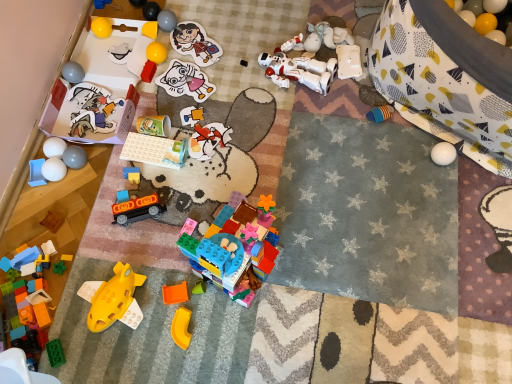
The width and height of the screenshot is (512, 384). Identify the location of free spot to the right of translucent orange plastic toy at center, placed as the 22th toy when sorted from left to right. [x=258, y=306].